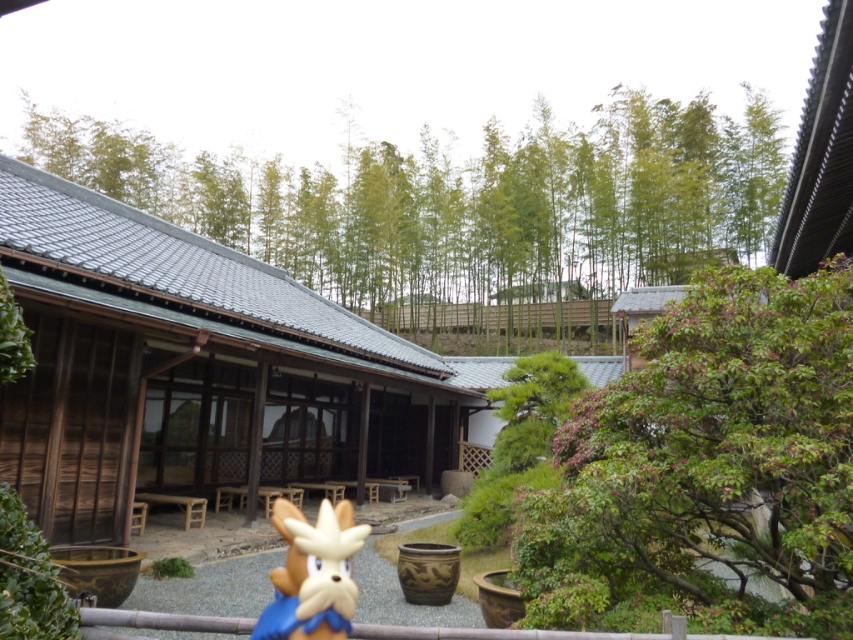
You are a visitor in the Japanese courtyard and want to place the brown plush toy at center on top of the brown wooden rail at lower center. Based on their sizes, will the plush toy fit on the rail without hanging over the edges?

The brown plush toy at center is thinner than the brown wooden rail at lower center, so it should fit without hanging over the edges since it is narrower.

You are standing in the traditional Japanese courtyard and see the point marked at coordinates (312, 573). What object is located at that point?

The point at coordinates (312, 573) indicates the location of the brown plush toy at center.

You are a visitor in the Japanese courtyard and notice the brown plush toy at center and the brown wooden rail at lower center. Which object is positioned higher from the ground?

The brown plush toy at center is located above the brown wooden rail at lower center, so it is positioned higher from the ground.